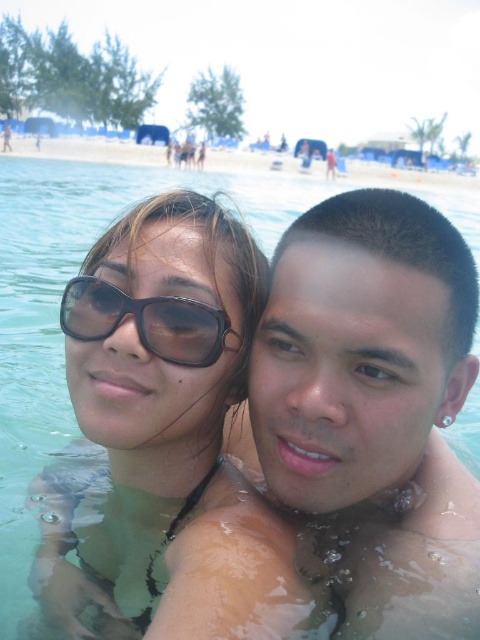
You are a photographer trying to capture the black plastic sunglasses at center and the clear sand at upper center in a new shot. Based on their positions, which object should you adjust your camera to focus on first if you want to include both in the frame?

The black plastic sunglasses at center is positioned on the left side of clear sand at upper center, so you should focus on the clear sand at upper center first to ensure both objects are in the frame.

In the scene shown: You are taking a selfie on the beach and notice the matte black sunglasses at center and the clear sand at upper center in your frame. Which object appears closer to the camera in the photo?

The matte black sunglasses at center appears closer to the camera because it is in front of the clear sand at upper center.